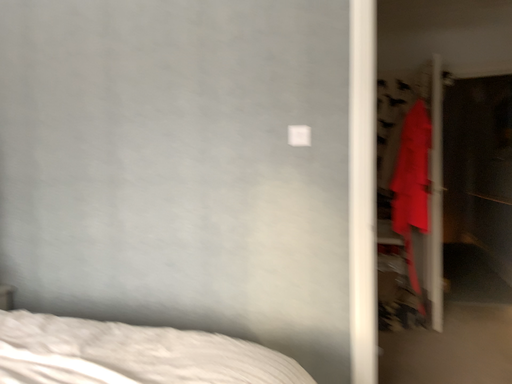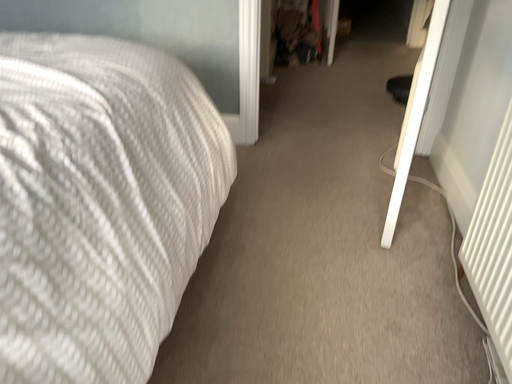
Question: Which way did the camera rotate in the video?

Choices:
 (A) rotated upward
 (B) rotated downward

Answer: (B)